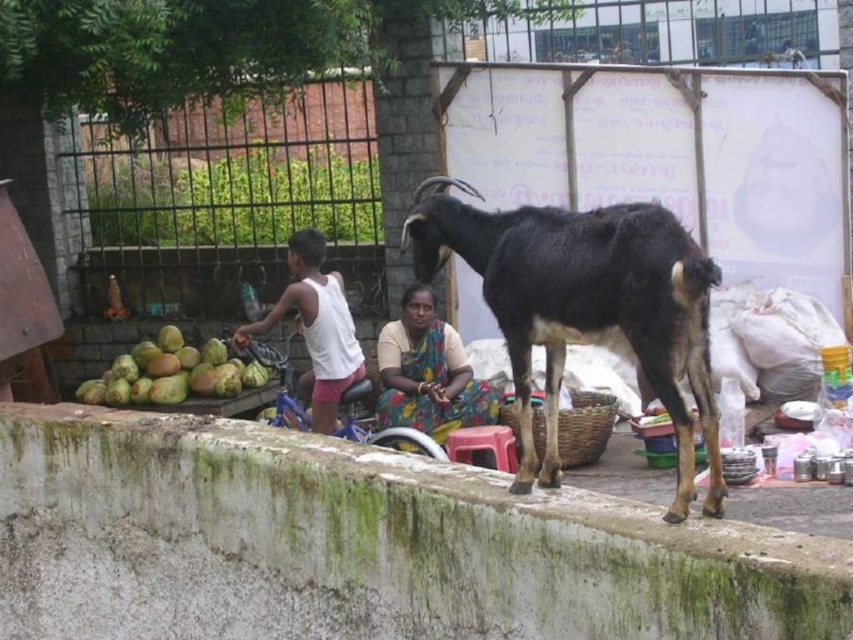
You are a photographer trying to capture the scene from the ground level. You notice the white cotton tank top at center and the green rough coconut at lower left. Which object would be in your camera frame first as you look down from the top of the wall?

The white cotton tank top at center is located above the green rough coconut at lower left, so when looking down from the top of the wall, the white cotton tank top at center would appear in the frame first before the green rough coconut at lower left.

Based on the photo, you are a photographer trying to capture the scene with a camera that has a 1.5 meter wide frame. You want to include both the multicolored fabric sari at center and the brown woven basket at center. Can you fit both within the frame without moving the camera?

The multicolored fabric sari at center is wider than the brown woven basket at center. Since the camera frame is 1.5 meters wide, and the sari is wider than the basket, it depends on the combined width of both objects. However, the description only states the sari is wider than the basket but does not provide exact measurements. Without knowing the exact widths, we cannot definitively determine if they will fit together within the frame.